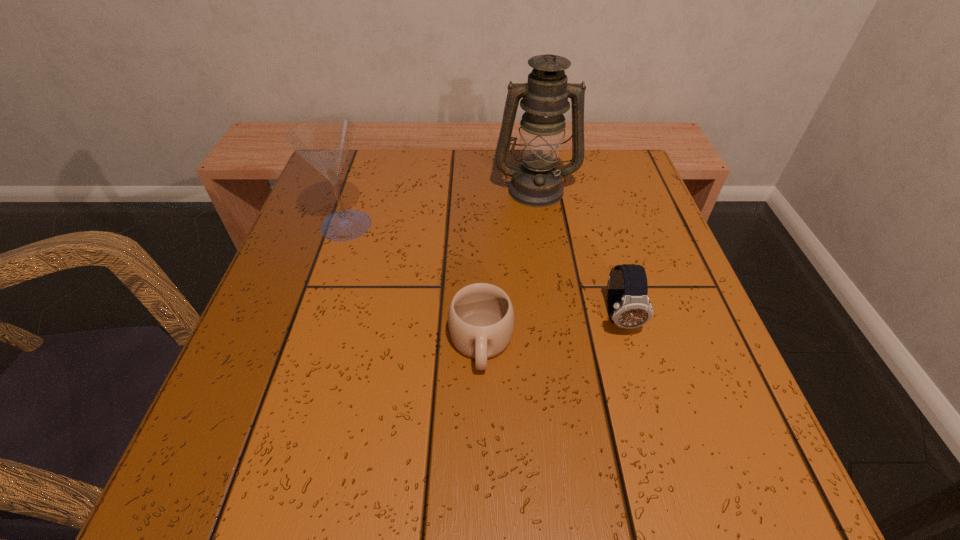
I want to click on the tallest object, so click(x=537, y=182).

Locate an element on the screen. the second tallest object is located at coordinates (325, 142).

The image size is (960, 540). Find the location of `flute glass`. flute glass is located at coordinates (325, 142).

At what (x,y) coordinates should I click in order to perform the action: click on the second shortest object. Please return your answer as a coordinate pair (x, y). The image size is (960, 540). Looking at the image, I should click on (628, 304).

Identify the location of the shortest object. This screenshot has height=540, width=960. (481, 317).

Identify the location of free region located 0.320m on the left of the tallest object. Image resolution: width=960 pixels, height=540 pixels. (353, 188).

What are the coordinates of `vacant space located on the back of the leftmost object` in the screenshot? It's located at (365, 167).

This screenshot has height=540, width=960. What are the coordinates of `free space located on the face of the third tallest object` in the screenshot? It's located at (635, 372).

Where is `vacant area located 0.170m on the side of the mug with the handle`? This screenshot has width=960, height=540. vacant area located 0.170m on the side of the mug with the handle is located at coordinates (481, 501).

At what (x,y) coordinates should I click in order to perform the action: click on object situated at the far edge. Please return your answer as a coordinate pair (x, y). Looking at the image, I should click on (537, 182).